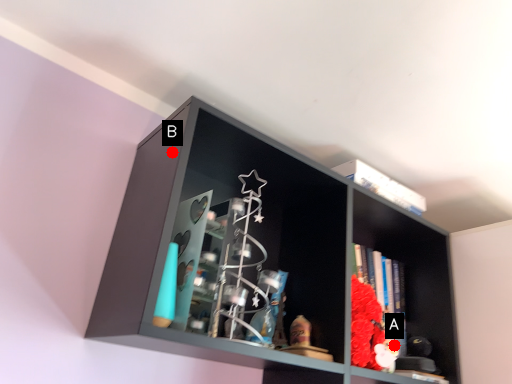
Question: Two points are circled on the image, labeled by A and B beside each circle. Which point appears closest to the camera in this image?

Choices:
 (A) A is closer
 (B) B is closer

Answer: (B)